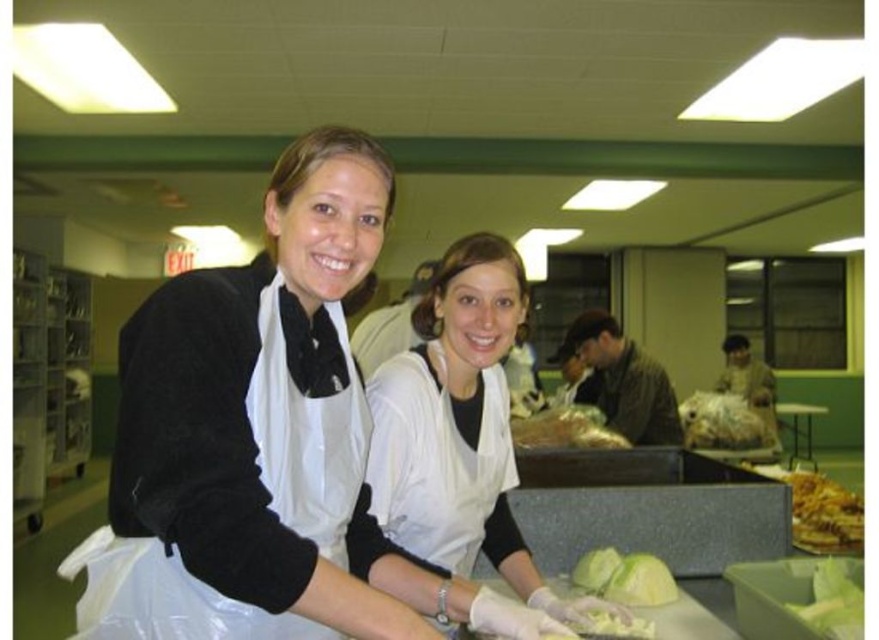
You are a volunteer at a community kitchen and need to hand out the golden crispy fries at lower right to a client. The client is standing near the translucent plastic bag at center. Is the bag blocking your direct path to the fries?

The golden crispy fries at lower right is positioned under the translucent plastic bag at center, so the bag is blocking the direct path to the fries. You will need to move the bag to access them.

You are a food service worker who needs to place the golden crispy fries at lower right into the translucent plastic bag at center. Based on their current positions, can you reach the fries without moving the bag?

The golden crispy fries at lower right are 32.13 inches away from the translucent plastic bag at center. Since the distance is over 30 inches, you would need to move either the fries or the bag to reach them comfortably.

You are a volunteer in this food preparation area and need to move from your current position to the point marked by point (811, 602). However, there is an obstacle at point (850, 502). Can you safely navigate around the obstacle to reach your destination?

Point (850, 502) is behind point (811, 602), so you can safely navigate around the obstacle at point (850, 502) to reach point (811, 602) without obstruction.